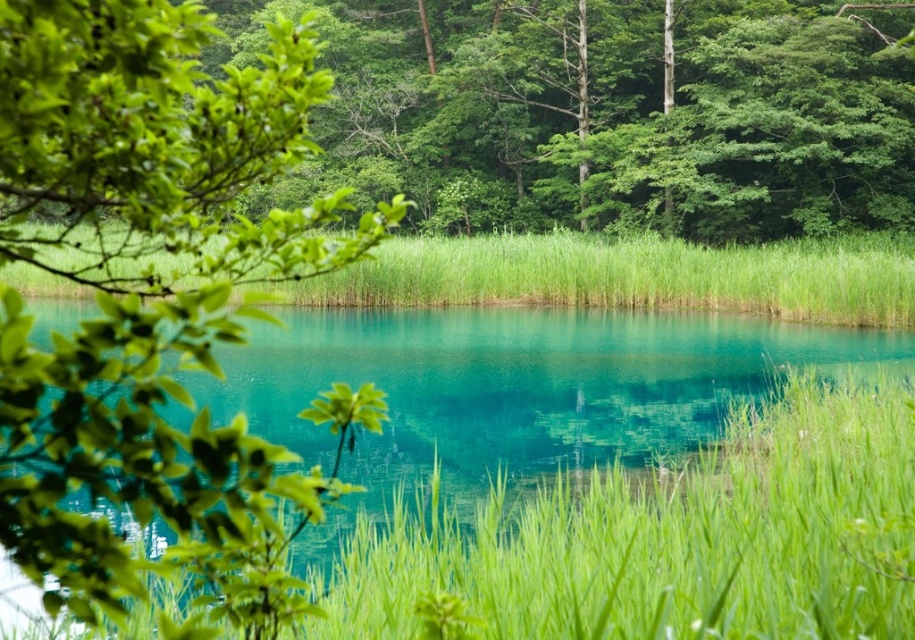
You are a gardener observing the scene and need to determine which area of green grass at center and green grassy at center requires more frequent mowing. Based on their height, which one should be mowed more often?

The green grass at center should be mowed more often because it is not as tall as the green grassy at center, indicating it grows faster and needs maintenance more frequently.

Looking at this image, you are standing in the middle of the scene and looking towards the green leafy tree at upper left. Which direction should you walk to avoid stepping on the green grass at center?

You should walk away from the green grass at center, towards the green leafy tree at upper left, since the tree is above the grass and walking towards it would take you away from the grass.

You are standing in the scene and see both the green grass at center and the green grassy at center. Which one is located to the right of the other?

The green grass at center is positioned on the right side of green grassy at center.